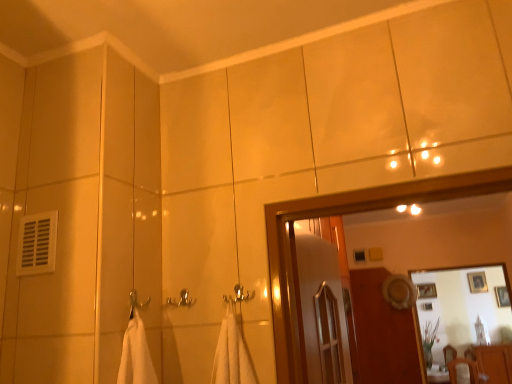
What do you see at coordinates (182, 299) in the screenshot? The image size is (512, 384). I see `silver metallic towel bar at center` at bounding box center [182, 299].

Identify the location of glossy wooden mirror at upper center. The height and width of the screenshot is (384, 512). (466, 322).

In order to click on silver metallic towel bar at center in this screenshot , I will do `click(182, 299)`.

Could you tell me if wooden framed picture at upper right, the second picture frame from the right, is turned towards glossy wooden mirror at upper center?

Yes, wooden framed picture at upper right, the second picture frame from the right, faces towards glossy wooden mirror at upper center.

Is wooden framed picture at upper right, placed as the 1th picture frame when sorted from left to right, directly adjacent to glossy wooden mirror at upper center?

No, wooden framed picture at upper right, placed as the 1th picture frame when sorted from left to right, is not making contact with glossy wooden mirror at upper center.

From the image's perspective, between wooden framed picture at upper right, placed as the 1th picture frame when sorted from left to right, and glossy wooden mirror at upper center, who is located below?

From the image's view, wooden framed picture at upper right, placed as the 1th picture frame when sorted from left to right, is below.

Considering the points (473, 277) and (432, 376), which point is in front, point (473, 277) or point (432, 376)?

The point (432, 376) is more forward.

Which object is positioned more to the left, glossy wooden mirror at upper center or wooden screen door at center?

From the viewer's perspective, wooden screen door at center appears more on the left side.

Is glossy wooden mirror at upper center far from wooden screen door at center?

glossy wooden mirror at upper center is far away from wooden screen door at center.

Does glossy wooden mirror at upper center come in front of wooden screen door at center?

No, the depth of glossy wooden mirror at upper center is greater than that of wooden screen door at center.

Is point (455, 292) closer to viewer compared to point (379, 337)?

No, it is not.

Can you confirm if matte brown dresser at lower right is bigger than glossy wooden mirror at upper center?

Yes, matte brown dresser at lower right is bigger than glossy wooden mirror at upper center.

Are matte brown dresser at lower right and glossy wooden mirror at upper center located far from each other?

No, matte brown dresser at lower right is in close proximity to glossy wooden mirror at upper center.

Looking at this image, is glossy wooden mirror at upper center surrounded by matte brown dresser at lower right?

No.

Is silver metallic towel bar at center in front of wooden framed picture at upper right, placed as the 1th picture frame when sorted from left to right?

Yes, silver metallic towel bar at center is closer to the viewer.

Between silver metallic towel bar at center and wooden framed picture at upper right, the second picture frame from the right, which one appears on the right side from the viewer's perspective?

wooden framed picture at upper right, the second picture frame from the right.

Choose the correct answer: Is silver metallic towel bar at center inside wooden framed picture at upper right, placed as the 1th picture frame when sorted from left to right, or outside it?

silver metallic towel bar at center is not enclosed by wooden framed picture at upper right, placed as the 1th picture frame when sorted from left to right.

Considering the relative sizes of silver metallic towel bar at center and wooden framed picture at upper right, the second picture frame from the right, in the image provided, is silver metallic towel bar at center shorter than wooden framed picture at upper right, the second picture frame from the right,?

Correct, silver metallic towel bar at center is not as tall as wooden framed picture at upper right, the second picture frame from the right.

Considering the positions of point (506, 302) and point (485, 287), is point (506, 302) closer or farther from the camera than point (485, 287)?

Point (506, 302).

Which of these two, wooden framed picture at upper right, which is the first picture frame from right to left, or wooden framed picture at upper right, placed as the 1th picture frame when sorted from left to right, stands shorter?

Standing shorter between the two is wooden framed picture at upper right, which is the first picture frame from right to left.

Would you say wooden framed picture at upper right, which appears as the second picture frame when viewed from the left, is inside or outside wooden framed picture at upper right, placed as the 1th picture frame when sorted from left to right?

wooden framed picture at upper right, which appears as the second picture frame when viewed from the left, lies outside wooden framed picture at upper right, placed as the 1th picture frame when sorted from left to right.

Is wooden framed picture at upper right, which is the first picture frame from right to left, next to wooden framed picture at upper right, placed as the 1th picture frame when sorted from left to right?

No, wooden framed picture at upper right, which is the first picture frame from right to left, is not in contact with wooden framed picture at upper right, placed as the 1th picture frame when sorted from left to right.

From the picture: From a real-world perspective, is matte brown dresser at lower right beneath wooden framed picture at upper right, placed as the 1th picture frame when sorted from left to right?

Yes, from a real-world perspective, matte brown dresser at lower right is under wooden framed picture at upper right, placed as the 1th picture frame when sorted from left to right.

Can you confirm if matte brown dresser at lower right is shorter than wooden framed picture at upper right, the second picture frame from the right?

In fact, matte brown dresser at lower right may be taller than wooden framed picture at upper right, the second picture frame from the right.

Is the surface of matte brown dresser at lower right in direct contact with wooden framed picture at upper right, the second picture frame from the right?

matte brown dresser at lower right and wooden framed picture at upper right, the second picture frame from the right, are clearly separated.

From a real-world perspective, is silver metallic towel bar at center above or below wooden screen door at center?

silver metallic towel bar at center is situated higher than wooden screen door at center in the real world.

Identify the location of towel bar in front of the wooden screen door at center. This screenshot has width=512, height=384. (182, 299).

Is wooden screen door at center inside silver metallic towel bar at center?

No, silver metallic towel bar at center does not contain wooden screen door at center.

Which is in front, point (172, 304) or point (408, 330)?

The point (172, 304) is closer to the camera.

Locate an element on the screen. the 2nd picture frame behind the glossy wooden mirror at upper center, counting from the anchor's position is located at coordinates (477, 282).

Image resolution: width=512 pixels, height=384 pixels. In order to click on mirror above the wooden screen door at center (from a real-world perspective) in this screenshot , I will do `click(466, 322)`.

From the image, which object appears to be nearer to wooden framed picture at upper right, which appears as the second picture frame when viewed from the left, wooden framed picture at upper right, the second picture frame from the right, or silver metallic towel bar at center?

Among the two, wooden framed picture at upper right, the second picture frame from the right, is located nearer to wooden framed picture at upper right, which appears as the second picture frame when viewed from the left.

From the picture: Looking at the image, which one is located further to glossy wooden mirror at upper center, matte brown dresser at lower right or wooden framed picture at upper right, the second picture frame from the right?

The object further to glossy wooden mirror at upper center is wooden framed picture at upper right, the second picture frame from the right.

From the image, which object appears to be farther from matte brown dresser at lower right, silver metallic towel bar at center or glossy wooden mirror at upper center?

The object further to matte brown dresser at lower right is silver metallic towel bar at center.

Considering their positions, is glossy wooden mirror at upper center positioned further to wooden framed picture at upper right, placed as the 1th picture frame when sorted from left to right, than wooden screen door at center?

wooden screen door at center lies further to wooden framed picture at upper right, placed as the 1th picture frame when sorted from left to right, than the other object.

Considering their positions, is wooden framed picture at upper right, which is the first picture frame from right to left, positioned closer to silver metallic towel bar at center than matte brown dresser at lower right?

matte brown dresser at lower right is positioned closer to the anchor silver metallic towel bar at center.

Based on their spatial positions, is wooden screen door at center or wooden framed picture at upper right, placed as the 1th picture frame when sorted from left to right, further from wooden framed picture at upper right, which appears as the second picture frame when viewed from the left?

Based on the image, wooden screen door at center appears to be further to wooden framed picture at upper right, which appears as the second picture frame when viewed from the left.

Which object lies further to the anchor point glossy wooden mirror at upper center, silver metallic towel bar at center or matte brown dresser at lower right?

silver metallic towel bar at center is further to glossy wooden mirror at upper center.

From the image, which object appears to be nearer to wooden framed picture at upper right, which is the first picture frame from right to left, wooden framed picture at upper right, the second picture frame from the right, or glossy wooden mirror at upper center?

wooden framed picture at upper right, the second picture frame from the right, is positioned closer to the anchor wooden framed picture at upper right, which is the first picture frame from right to left.

Image resolution: width=512 pixels, height=384 pixels. Find the location of `picture frame that lies between wooden framed picture at upper right, the second picture frame from the right, and matte brown dresser at lower right from top to bottom`. picture frame that lies between wooden framed picture at upper right, the second picture frame from the right, and matte brown dresser at lower right from top to bottom is located at coordinates (502, 296).

Where is `mirror between wooden screen door at center and wooden framed picture at upper right, the second picture frame from the right, along the z-axis`? This screenshot has height=384, width=512. mirror between wooden screen door at center and wooden framed picture at upper right, the second picture frame from the right, along the z-axis is located at coordinates (466, 322).

The height and width of the screenshot is (384, 512). In order to click on dresser between wooden screen door at center and wooden framed picture at upper right, the second picture frame from the right, along the z-axis in this screenshot , I will do `click(495, 362)`.

The image size is (512, 384). Find the location of `dresser located between glossy wooden mirror at upper center and wooden framed picture at upper right, which is the first picture frame from right to left, in the depth direction`. dresser located between glossy wooden mirror at upper center and wooden framed picture at upper right, which is the first picture frame from right to left, in the depth direction is located at coordinates (495, 362).